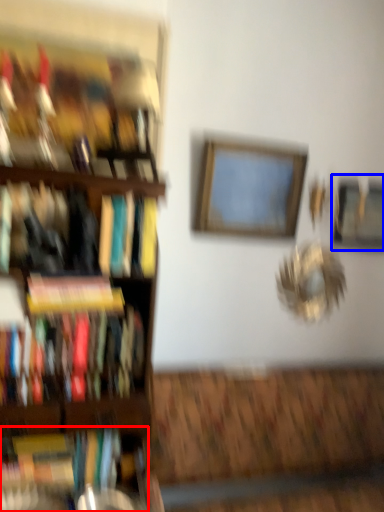
Question: Which object is further to the camera taking this photo, book (highlighted by a red box) or picture frame (highlighted by a blue box)?

Choices:
 (A) book
 (B) picture frame

Answer: (B)